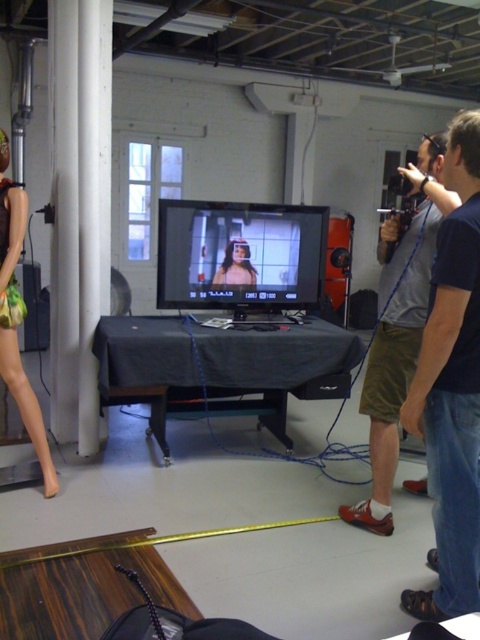
You are a photographer setting up a shoot in the studio. You need to place a 3.5 meter long backdrop roll between the matte plastic mannequin at left and the large window with multiple panes. Will the backdrop roll fit between them?

The distance between the matte plastic mannequin at left and the large window with multiple panes is 2.74 meters. Since the backdrop roll is 3.5 meters long, it will not fit between them as the space is shorter than the roll.

You are a photographer setting up a shoot in this studio. You need to place a new light stand at the exact point specified by the coordinates point (17, 316). What object will be directly under the light stand when it is placed there?

The point (17, 316) is occupied by the matte plastic mannequin at left, so placing the light stand there would position it directly under the matte plastic mannequin at left.

You are a fashion designer who needs to determine if the matte khaki shorts at right can fit onto the matte plastic mannequin at left. Based on the size comparison provided, what is your conclusion?

The matte khaki shorts at right has a larger size compared to the matte plastic mannequin at left, so the shorts may not fit properly on the mannequin due to their larger size.